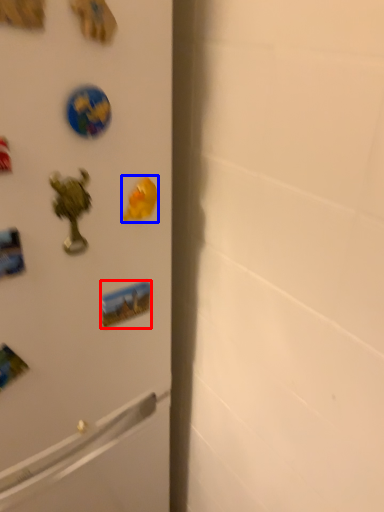
Question: Which point is further to the camera, sticker (highlighted by a red box) or magnet (highlighted by a blue box)?

Choices:
 (A) sticker
 (B) magnet

Answer: (A)